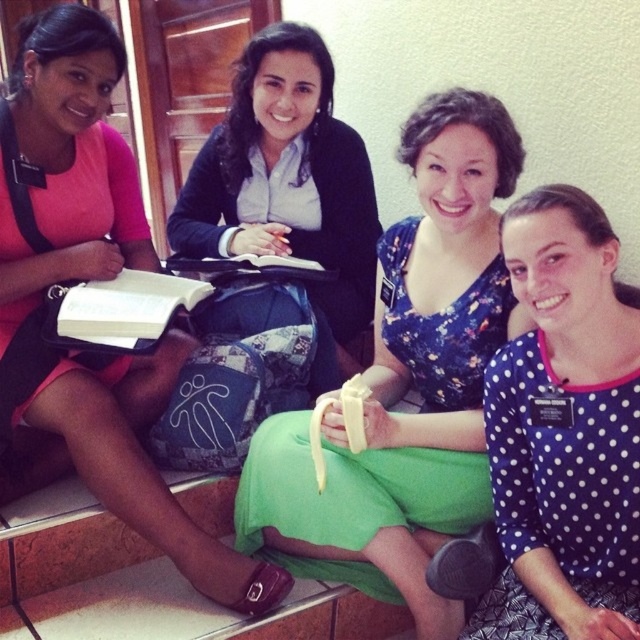
Identify the location of pink matte shirt at upper left. (88, 280).

Is pink matte shirt at upper left taller than matte black sweater at center?

Yes.

Between point (100, 154) and point (202, 330), which one is positioned in front?

Positioned in front is point (100, 154).

I want to click on pink matte shirt at upper left, so tap(88, 280).

Is floral fabric dress at center taller than blue polka dot shirt at center?

Yes, floral fabric dress at center is taller than blue polka dot shirt at center.

Between floral fabric dress at center and blue polka dot shirt at center, which one appears on the left side from the viewer's perspective?

floral fabric dress at center is more to the left.

Identify the location of floral fabric dress at center. Image resolution: width=640 pixels, height=640 pixels. (406, 381).

Based on the photo, can you confirm if floral fabric dress at center is shorter than pink matte shirt at upper left?

Indeed, floral fabric dress at center has a lesser height compared to pink matte shirt at upper left.

Can you confirm if floral fabric dress at center is wider than pink matte shirt at upper left?

No, floral fabric dress at center is not wider than pink matte shirt at upper left.

What do you see at coordinates (406, 381) in the screenshot?
I see `floral fabric dress at center` at bounding box center [406, 381].

Where is `floral fabric dress at center`? The image size is (640, 640). floral fabric dress at center is located at coordinates (406, 381).